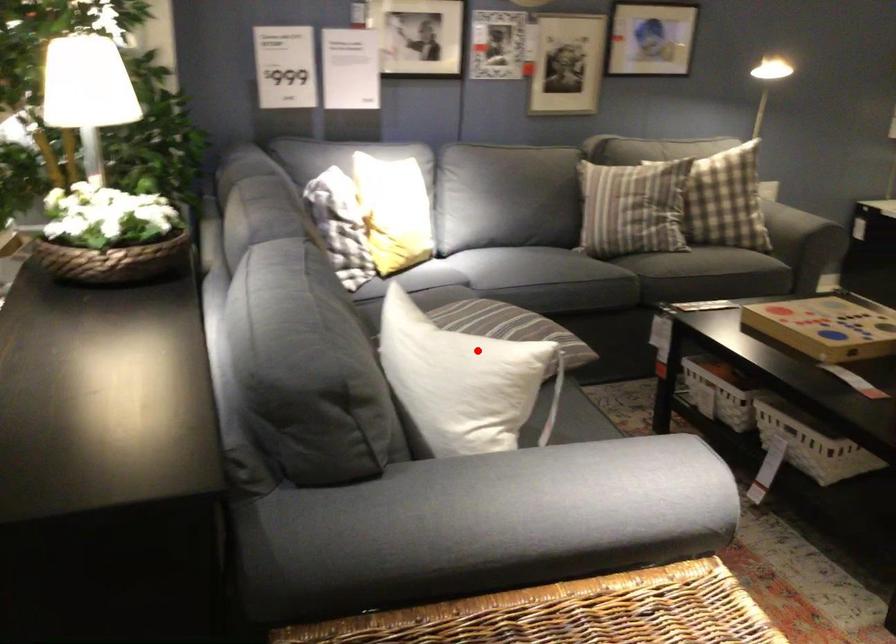
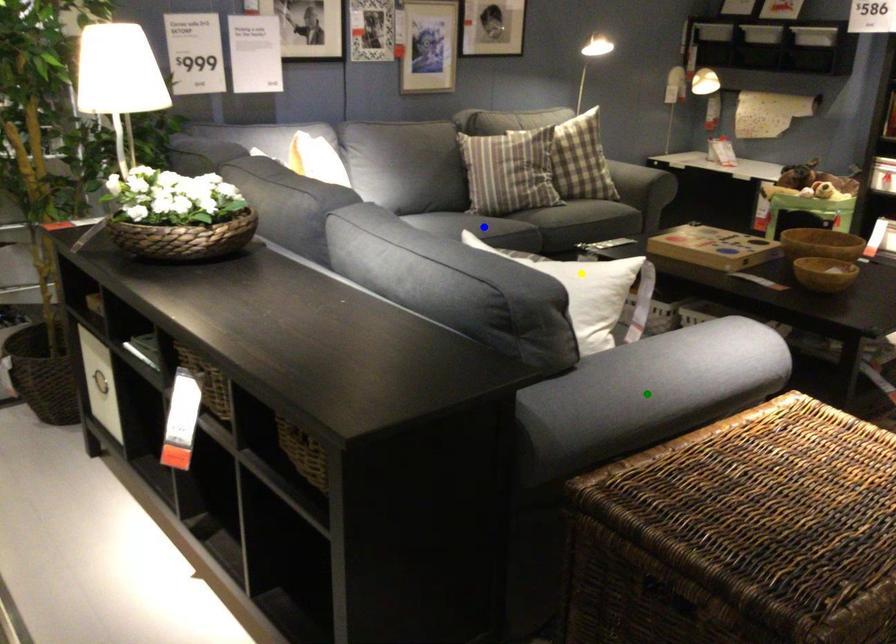
Question: I am providing you with two images of the same scene from different viewpoints. A red point is marked on the first image. You are given multiple points on the second image. Can you choose the point in image 2 that corresponds to the point in image 1?

Choices:
 (A) yellow point
 (B) blue point
 (C) green point

Answer: (A)